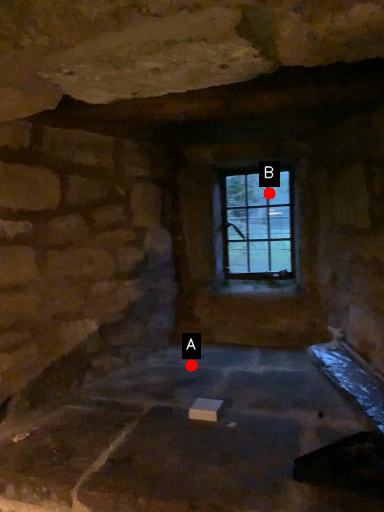
Question: Two points are circled on the image, labeled by A and B beside each circle. Which point is farther to the camera?

Choices:
 (A) A is further
 (B) B is further

Answer: (B)